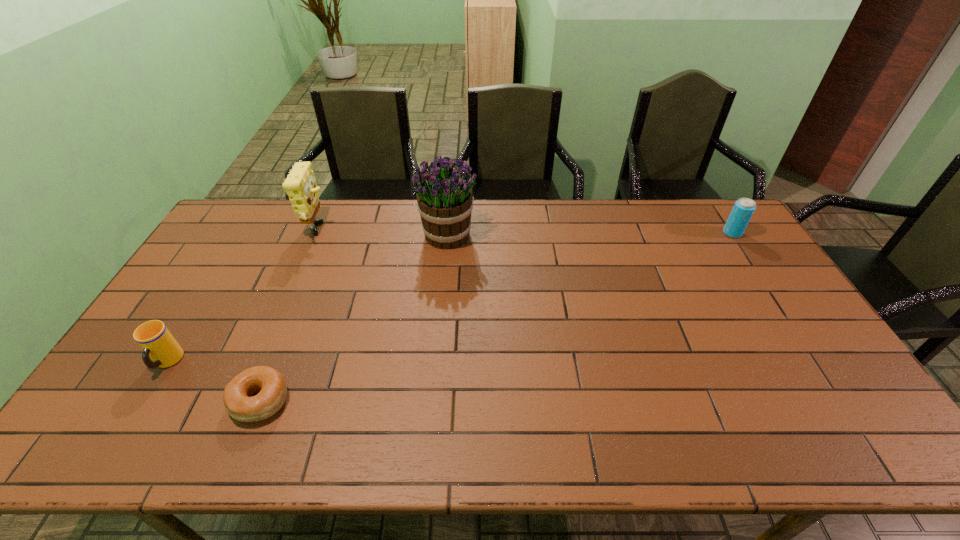
Where is `blank space located on the right of the bagel`? This screenshot has width=960, height=540. blank space located on the right of the bagel is located at coordinates (357, 401).

I want to click on bouquet present at the far edge, so click(444, 195).

Find the location of a particular element. This screenshot has width=960, height=540. sponge situated at the far edge is located at coordinates (300, 185).

Locate an element on the screen. soda can that is positioned at the far edge is located at coordinates (743, 209).

At what (x,y) coordinates should I click in order to perform the action: click on object that is positioned at the near edge. Please return your answer as a coordinate pair (x, y). The image size is (960, 540). Looking at the image, I should click on click(x=271, y=385).

The image size is (960, 540). I want to click on object located in the left edge section of the desktop, so click(157, 342).

This screenshot has height=540, width=960. Find the location of `object present at the right edge`. object present at the right edge is located at coordinates (743, 209).

This screenshot has width=960, height=540. I want to click on object at the far right corner, so click(743, 209).

Image resolution: width=960 pixels, height=540 pixels. What are the coordinates of `blank space at the far edge` in the screenshot? It's located at (599, 227).

At what (x,y) coordinates should I click in order to perform the action: click on vacant position at the near edge of the desktop. Please return your answer as a coordinate pair (x, y). Image resolution: width=960 pixels, height=540 pixels. Looking at the image, I should click on (657, 450).